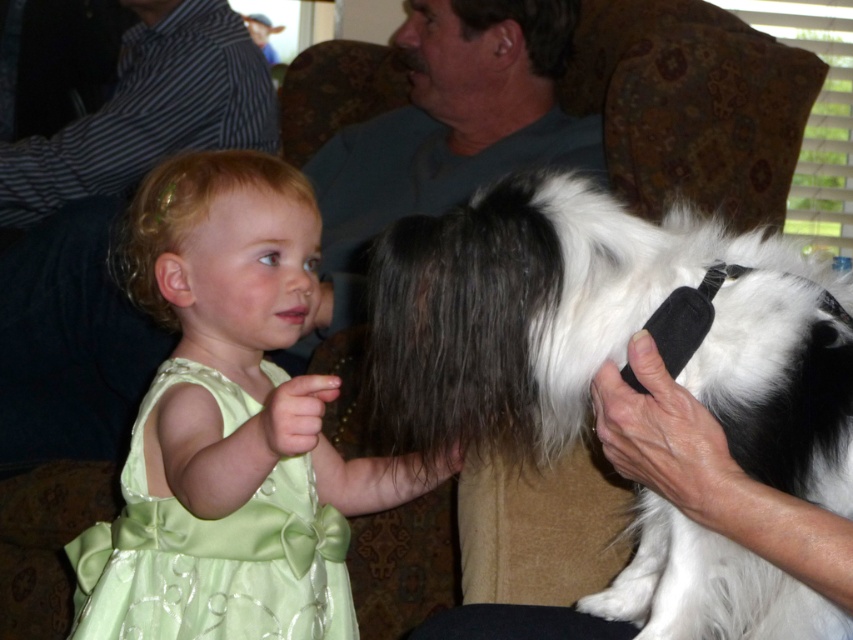
You are standing in the room and want to locate the green satin dress at center. According to the coordinates provided, where should you look relative to the frame?

The green satin dress at center is located at coordinates point 0.666 on the x axis and 0.271 on the y axis, so you should look towards the upper right side of the frame.

You are a photographer taking a picture of the scene. You need to adjust your focus so that both the black and white fur at center and the green satin dress at center are in clear view. Which object should you focus on first to ensure both are in focus?

You should focus on the black and white fur at center first because it is closer to you than the green satin dress at center, allowing both to be in focus when adjusting the depth of field.